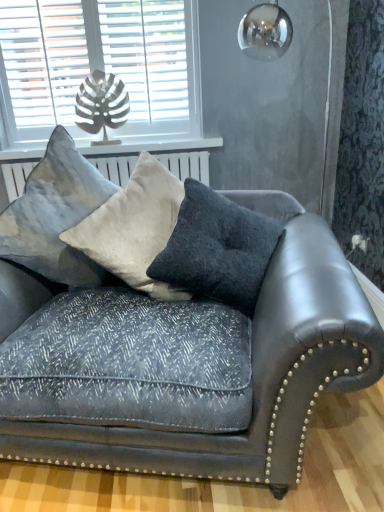
From the picture: Measure the distance between point [169,177] and camera.

A distance of 5.86 feet exists between point [169,177] and camera.

What is the approximate width of textured gray pillow at upper left, arranged as the first pillow when viewed from the left?

It is 20.38 inches.

From the picture: Measure the distance between white wooden blinds at upper left and camera.

white wooden blinds at upper left and camera are 7.36 feet apart.

Identify the location of velvet dark gray couch at center. (171, 347).

From a real-world perspective, is velvet dark gray couch at center physically below white painted wood at upper left?

Indeed, from a real-world perspective, velvet dark gray couch at center is positioned beneath white painted wood at upper left.

Who is shorter, velvet dark gray couch at center or white painted wood at upper left?

With less height is white painted wood at upper left.

Based on the photo, are velvet dark gray couch at center and white painted wood at upper left far apart?

Yes, velvet dark gray couch at center and white painted wood at upper left are quite far apart.

Which of these two, white wooden blinds at upper left or textured velvet pillow at center, the 2th pillow from the right, is thinner?

Thinner between the two is white wooden blinds at upper left.

Would you say white wooden blinds at upper left is inside or outside textured velvet pillow at center, the 2th pillow viewed from the left?

white wooden blinds at upper left cannot be found inside textured velvet pillow at center, the 2th pillow viewed from the left.

Who is more distant, white wooden blinds at upper left or textured velvet pillow at center, the 2th pillow viewed from the left?

white wooden blinds at upper left is more distant.

How different are the orientations of textured gray pillow at upper left, which ranks as the 3th pillow in right-to-left order, and dark gray textured pillow at center, the first pillow viewed from the right, in degrees?

The angle between the facing direction of textured gray pillow at upper left, which ranks as the 3th pillow in right-to-left order, and the facing direction of dark gray textured pillow at center, the first pillow viewed from the right, is 0.000571 degrees.

Visually, is textured gray pillow at upper left, which ranks as the 3th pillow in right-to-left order, positioned to the left or to the right of dark gray textured pillow at center, which is the 3th pillow from left to right?

Clearly, textured gray pillow at upper left, which ranks as the 3th pillow in right-to-left order, is on the left of dark gray textured pillow at center, which is the 3th pillow from left to right, in the image.

Is textured gray pillow at upper left, which ranks as the 3th pillow in right-to-left order, positioned behind dark gray textured pillow at center, the first pillow viewed from the right?

Yes.

Which of these two, textured gray pillow at upper left, arranged as the first pillow when viewed from the left, or dark gray textured pillow at center, the first pillow viewed from the right, is smaller?

Smaller between the two is dark gray textured pillow at center, the first pillow viewed from the right.

Is velvet dark gray couch at center placed right next to textured velvet pillow at center, the 2th pillow viewed from the left?

No, velvet dark gray couch at center is not next to textured velvet pillow at center, the 2th pillow viewed from the left.

From the velvet dark gray couch at center, count the 1st pillow to the left and point to it. Please provide its 2D coordinates.

[(134, 227)]

From a real-world perspective, relative to textured velvet pillow at center, the 2th pillow from the right, is velvet dark gray couch at center vertically above or below?

Clearly, from a real-world perspective, velvet dark gray couch at center is below textured velvet pillow at center, the 2th pillow from the right.

Are dark gray textured pillow at center, which is the 3th pillow from left to right, and white painted wood at upper left far apart?

Yes, dark gray textured pillow at center, which is the 3th pillow from left to right, and white painted wood at upper left are quite far apart.

Can you confirm if dark gray textured pillow at center, the first pillow viewed from the right, is smaller than white painted wood at upper left?

No, dark gray textured pillow at center, the first pillow viewed from the right, is not smaller than white painted wood at upper left.

Does dark gray textured pillow at center, which is the 3th pillow from left to right, turn towards white painted wood at upper left?

No, dark gray textured pillow at center, which is the 3th pillow from left to right, does not turn towards white painted wood at upper left.

Is dark gray textured pillow at center, which is the 3th pillow from left to right, thinner than white painted wood at upper left?

In fact, dark gray textured pillow at center, which is the 3th pillow from left to right, might be wider than white painted wood at upper left.

Is textured velvet pillow at center, the 2th pillow from the right, in contact with velvet dark gray couch at center?

No, textured velvet pillow at center, the 2th pillow from the right, is not making contact with velvet dark gray couch at center.

Does textured velvet pillow at center, the 2th pillow viewed from the left, have a larger size compared to velvet dark gray couch at center?

No.

Between textured velvet pillow at center, the 2th pillow from the right, and velvet dark gray couch at center, which one has larger width?

Wider between the two is velvet dark gray couch at center.

Which point is more forward, [92,156] or [73,298]?

The point [73,298] is closer to the camera.

From a real-world perspective, which object stands above the other?

From a 3D spatial view, white painted wood at upper left is above.

From the image's perspective, does white painted wood at upper left appear higher than velvet dark gray couch at center?

Yes, from the image's perspective, white painted wood at upper left is on top of velvet dark gray couch at center.

This screenshot has width=384, height=512. In the image, there is a white painted wood at upper left. In order to click on studio couch below it (from a real-world perspective) in this screenshot , I will do `click(171, 347)`.

This screenshot has width=384, height=512. Identify the location of the 2nd pillow in front of the white wooden blinds at upper left, starting your count from the anchor. (134, 227).

Looking at the image, which one is located closer to white painted wood at upper left, velvet dark gray couch at center or textured velvet pillow at center, the 2th pillow from the right?

textured velvet pillow at center, the 2th pillow from the right, is positioned closer to the anchor white painted wood at upper left.

Based on their spatial positions, is velvet dark gray couch at center or white wooden blinds at upper left closer to white painted wood at upper left?

white wooden blinds at upper left.

Looking at the image, which one is located closer to white painted wood at upper left, textured gray pillow at upper left, arranged as the first pillow when viewed from the left, or dark gray textured pillow at center, which is the 3th pillow from left to right?

textured gray pillow at upper left, arranged as the first pillow when viewed from the left, lies closer to white painted wood at upper left than the other object.

When comparing their distances from white painted wood at upper left, does dark gray textured pillow at center, which is the 3th pillow from left to right, or textured gray pillow at upper left, which ranks as the 3th pillow in right-to-left order, seem closer?

The object closer to white painted wood at upper left is textured gray pillow at upper left, which ranks as the 3th pillow in right-to-left order.

Which object lies nearer to the anchor point dark gray textured pillow at center, the first pillow viewed from the right, white wooden blinds at upper left or textured gray pillow at upper left, which ranks as the 3th pillow in right-to-left order?

Among the two, textured gray pillow at upper left, which ranks as the 3th pillow in right-to-left order, is located nearer to dark gray textured pillow at center, the first pillow viewed from the right.

Which object lies further to the anchor point textured velvet pillow at center, the 2th pillow viewed from the left, textured gray pillow at upper left, arranged as the first pillow when viewed from the left, or white painted wood at upper left?

white painted wood at upper left is positioned further to the anchor textured velvet pillow at center, the 2th pillow viewed from the left.

When comparing their distances from textured velvet pillow at center, the 2th pillow viewed from the left, does textured gray pillow at upper left, which ranks as the 3th pillow in right-to-left order, or velvet dark gray couch at center seem further?

velvet dark gray couch at center.

Considering their positions, is white wooden blinds at upper left positioned further to textured velvet pillow at center, the 2th pillow viewed from the left, than dark gray textured pillow at center, which is the 3th pillow from left to right?

white wooden blinds at upper left is further to textured velvet pillow at center, the 2th pillow viewed from the left.

The height and width of the screenshot is (512, 384). What are the coordinates of `window between textured velvet pillow at center, the 2th pillow viewed from the left, and white painted wood at upper left in the front-back direction` in the screenshot? It's located at (100, 70).

The width and height of the screenshot is (384, 512). In order to click on pillow located between velvet dark gray couch at center and textured velvet pillow at center, the 2th pillow from the right, in the depth direction in this screenshot , I will do pos(217,250).

You are a GUI agent. You are given a task and a screenshot of the screen. Output one action in this format:
    pyautogui.click(x=<x>, y=<y>)
    Task: Click on the window between dark gray textured pillow at center, which is the 3th pillow from left to right, and white painted wood at upper left, along the z-axis
    
    Given the screenshot: What is the action you would take?
    pyautogui.click(x=100, y=70)

Image resolution: width=384 pixels, height=512 pixels. Find the location of `pillow located between textured velvet pillow at center, the 2th pillow viewed from the left, and white wooden blinds at upper left in the depth direction`. pillow located between textured velvet pillow at center, the 2th pillow viewed from the left, and white wooden blinds at upper left in the depth direction is located at coordinates (55, 215).